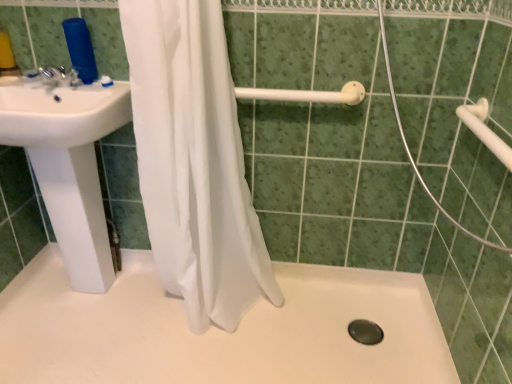
Locate an element on the screen. vacant area that is in front of white glossy sink at left is located at coordinates (63, 357).